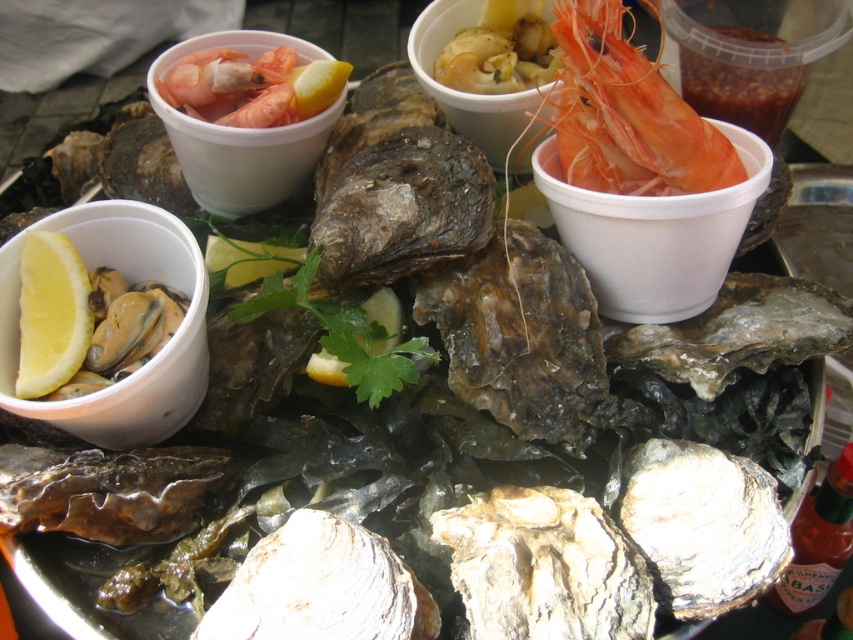
You are a food critic analyzing the layout of the seafood platter. Where is the shiny orange shrimp at upper right positioned relative to the other seafood items on the platter?

The shiny orange shrimp at upper right is located at point (x=627, y=115), which places it in the upper right area of the platter, near the edge.

You are a food stylist arranging a seafood platter. You have a shiny orange shrimp at upper right and a yellow matte lemon at lower left. Which object is taller?

The shiny orange shrimp at upper right is taller than the yellow matte lemon at lower left.